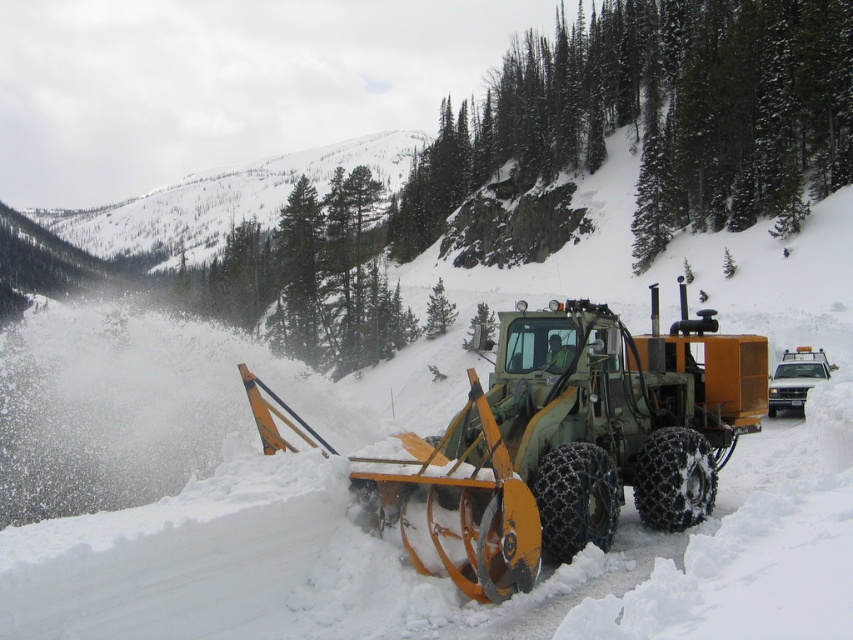
You are a snowplow operator who needs to choose between the green metallic snowplow at center and the green rubber snowplow at center for clearing a particularly icy road. Based on their sizes, which one would you recommend and why?

The green metallic snowplow at center has a larger size compared to the green rubber snowplow at center. A larger plow is generally more effective for clearing heavy snow and ice, so the green metallic snowplow at center would be the better choice for the icy road.

You are a delivery driver who needs to pass through this road. The snowplow is clearing the road, but there are two snowplows here. You see the green metallic snowplow at center and the green rubber snowplow at center. Can you safely pass between them while driving a truck that is 2.5 meters wide?

The distance between the green metallic snowplow at center and the green rubber snowplow at center is 11.89 meters. Since your truck is only 2.5 meters wide, there is more than enough space to safely pass between them.